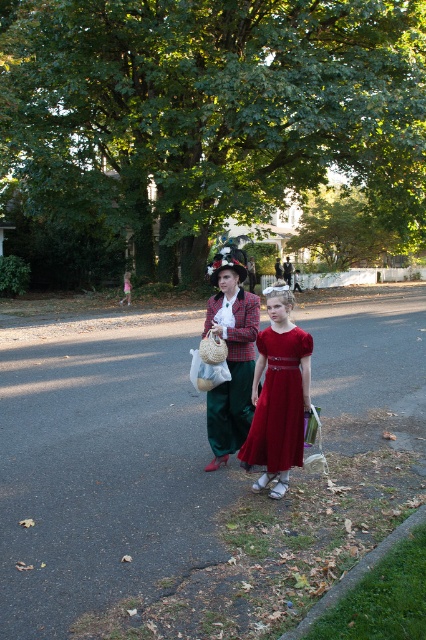
You are standing at point (127, 288) and want to walk to point (285, 358). Which direction should you move in relative to the two points?

You should move forward towards point (285, 358) since it is in front of point (127, 288).

From the picture: Based on the scene description, which object is larger in size between the matte plaid coat at center and the shiny satin dress at center?

The matte plaid coat at center is bigger than the shiny satin dress at center according to the description.

From the picture: You are standing 5 meters away from the shiny satin dress at center. Can you comfortably reach it without moving closer?

The shiny satin dress at center and viewer are 4.45 meters apart. Since you are 5 meters away, you are too far to comfortably reach it without moving closer.